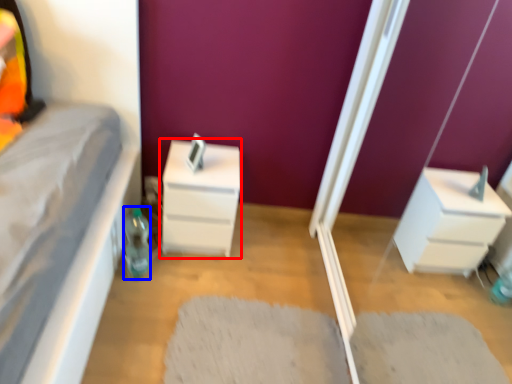
Question: Which point is further to the camera, chest of drawers (highlighted by a red box) or bottle (highlighted by a blue box)?

Choices:
 (A) chest of drawers
 (B) bottle

Answer: (A)